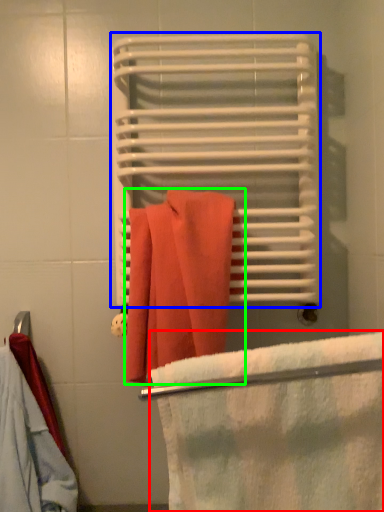
Question: Estimate the real-world distances between objects in this image. Which object is closer to beach towel (highlighted by a red box), bath towel (highlighted by a blue box) or towel (highlighted by a green box)?

Choices:
 (A) bath towel
 (B) towel

Answer: (B)